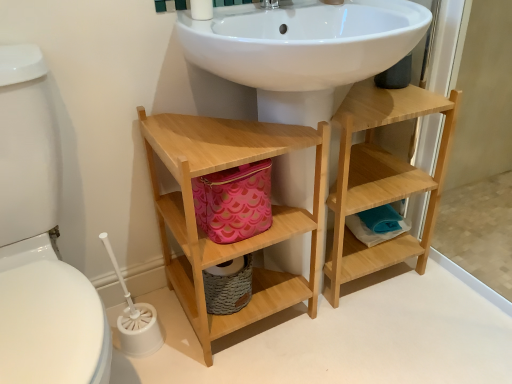
Question: Can you confirm if natural wood bathroom cabinet at lower center is smaller than white glossy toilet bowl at left?

Choices:
 (A) yes
 (B) no

Answer: (A)

Question: Is natural wood bathroom cabinet at lower center positioned beyond the bounds of white glossy toilet bowl at left?

Choices:
 (A) yes
 (B) no

Answer: (A)

Question: From the image's perspective, is natural wood bathroom cabinet at lower center beneath white glossy toilet bowl at left?

Choices:
 (A) yes
 (B) no

Answer: (B)

Question: Can you confirm if natural wood bathroom cabinet at lower center is taller than white glossy toilet bowl at left?

Choices:
 (A) no
 (B) yes

Answer: (A)

Question: Is white glossy toilet bowl at left completely or partially inside natural wood bathroom cabinet at lower center?

Choices:
 (A) no
 (B) yes

Answer: (A)

Question: From a real-world perspective, is natural wood bathroom cabinet at lower center physically above white glossy toilet bowl at left?

Choices:
 (A) yes
 (B) no

Answer: (B)

Question: Does white plastic toilet brush at lower left lie in front of white glossy toilet bowl at left?

Choices:
 (A) yes
 (B) no

Answer: (B)

Question: Does white plastic toilet brush at lower left turn towards white glossy toilet bowl at left?

Choices:
 (A) no
 (B) yes

Answer: (A)

Question: Can you confirm if white plastic toilet brush at lower left is taller than white glossy toilet bowl at left?

Choices:
 (A) yes
 (B) no

Answer: (B)

Question: Is white plastic toilet brush at lower left thinner than white glossy toilet bowl at left?

Choices:
 (A) no
 (B) yes

Answer: (B)

Question: Is white plastic toilet brush at lower left wider than white glossy toilet bowl at left?

Choices:
 (A) yes
 (B) no

Answer: (B)

Question: Is white plastic toilet brush at lower left positioned with its back to white glossy toilet bowl at left?

Choices:
 (A) no
 (B) yes

Answer: (A)

Question: Can you confirm if white glossy toilet bowl at left is positioned to the right of white plastic toilet brush at lower left?

Choices:
 (A) no
 (B) yes

Answer: (A)